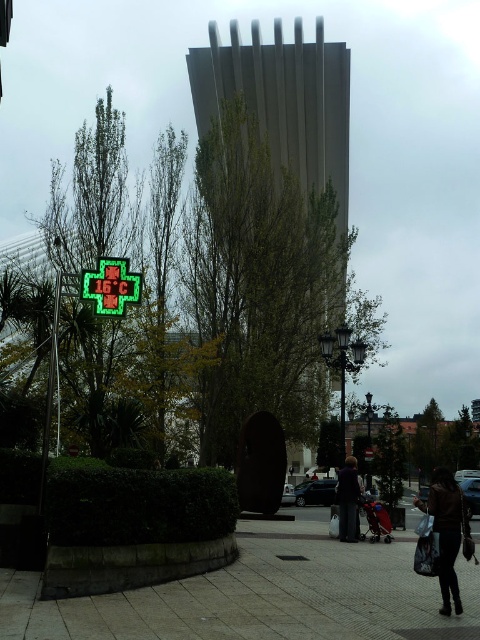
Question: Among these objects, which one is farthest from the camera?

Choices:
 (A) green led sign at lower left
 (B) gray concrete pavement at lower center

Answer: (A)

Question: Is gray concrete pavement at lower center below dark gray suit at center?

Choices:
 (A) yes
 (B) no

Answer: (B)

Question: Can you confirm if smooth gray tower at center is thinner than dark brown leather jacket at lower right?

Choices:
 (A) yes
 (B) no

Answer: (B)

Question: Which of the following is the farthest from the observer?

Choices:
 (A) smooth gray tower at center
 (B) green led sign at lower left
 (C) gray concrete pavement at lower center

Answer: (A)

Question: Can you confirm if green led sign at lower left is positioned to the right of dark gray suit at center?

Choices:
 (A) yes
 (B) no

Answer: (B)

Question: Which of the following is the closest to the observer?

Choices:
 (A) dark brown leather jacket at lower right
 (B) green led sign at lower left
 (C) dark gray suit at center

Answer: (A)